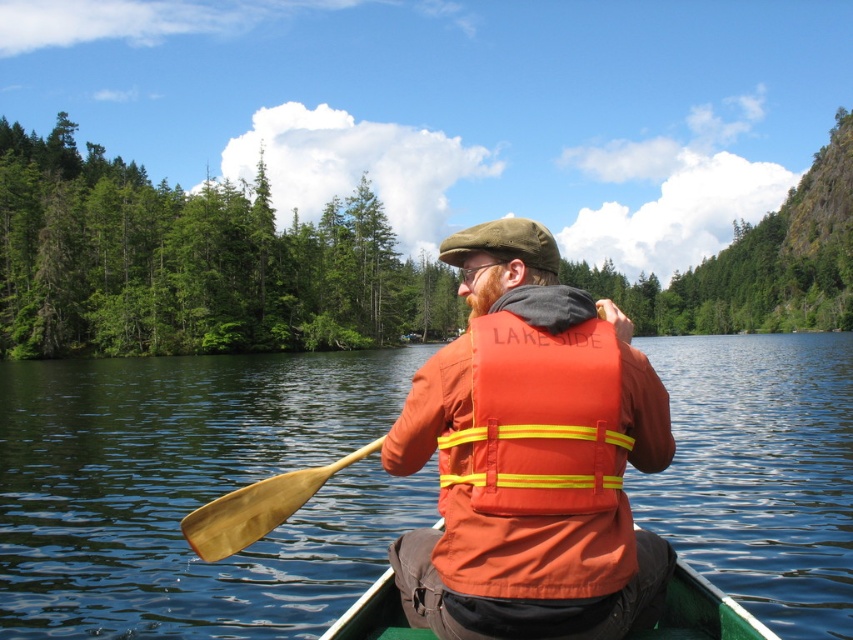
Between point (212, 266) and point (194, 529), which one is positioned in front?

Point (194, 529) is in front.

Is green leafy trees at left positioned before wooden paddle at lower left?

No.

Where is `green leafy trees at left`? This screenshot has height=640, width=853. green leafy trees at left is located at coordinates (192, 262).

Can you confirm if orange fabric life vest at center is bigger than green plastic canoe at center?

Incorrect, orange fabric life vest at center is not larger than green plastic canoe at center.

Is orange fabric life vest at center positioned at the back of green plastic canoe at center?

Yes, it is.

What are the coordinates of `orange fabric life vest at center` in the screenshot? It's located at (531, 456).

Which is above, transparent water at center or green leafy trees at left?

green leafy trees at left is above.

Who is lower down, transparent water at center or green leafy trees at left?

transparent water at center is lower down.

At what (x,y) coordinates should I click in order to perform the action: click on transparent water at center. Please return your answer as a coordinate pair (x, y). Image resolution: width=853 pixels, height=640 pixels. Looking at the image, I should click on (193, 490).

What are the coordinates of `transparent water at center` in the screenshot? It's located at (193, 490).